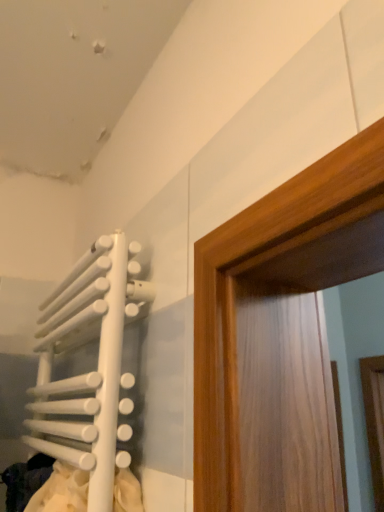
Question: Based on their positions, is white matte laundry at lower left located to the left or right of white matte radiator at left?

Choices:
 (A) left
 (B) right

Answer: (B)

Question: Do you think white matte laundry at lower left is within white matte radiator at left, or outside of it?

Choices:
 (A) outside
 (B) inside

Answer: (B)

Question: In the image, is white matte laundry at lower left positioned in front of or behind white matte radiator at left?

Choices:
 (A) front
 (B) behind

Answer: (B)

Question: In terms of width, does white matte radiator at left look wider or thinner when compared to white matte laundry at lower left?

Choices:
 (A) thin
 (B) wide

Answer: (A)

Question: Considering their positions, is white matte radiator at left located in front of or behind white matte laundry at lower left?

Choices:
 (A) front
 (B) behind

Answer: (A)

Question: Is point (74, 414) closer or farther from the camera than point (16, 508)?

Choices:
 (A) farther
 (B) closer

Answer: (B)

Question: From the image's perspective, relative to white matte laundry at lower left, is white matte radiator at left above or below?

Choices:
 (A) below
 (B) above

Answer: (B)